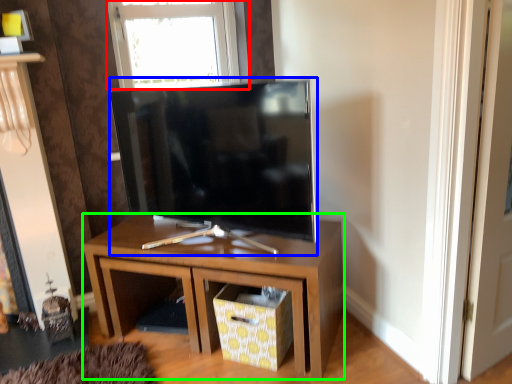
Question: Estimate the real-world distances between objects in this image. Which object is farther from window (highlighted by a red box), television (highlighted by a blue box) or nightstand (highlighted by a green box)?

Choices:
 (A) television
 (B) nightstand

Answer: (B)